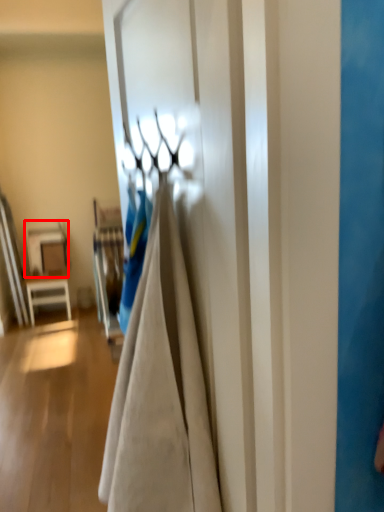
Question: From the image, what is the correct spatial relationship of table (annotated by the red box) in relation to door?

Choices:
 (A) right
 (B) left

Answer: (B)